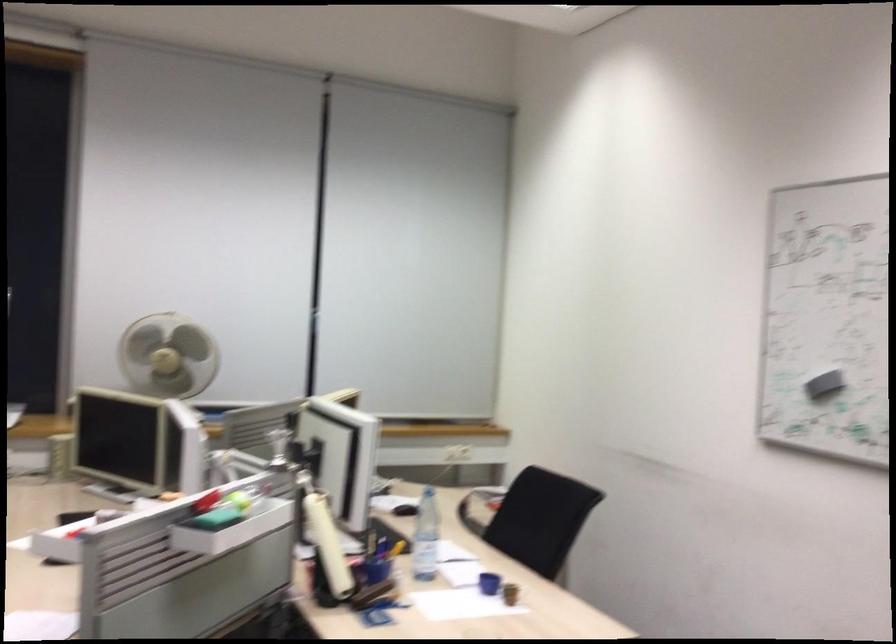
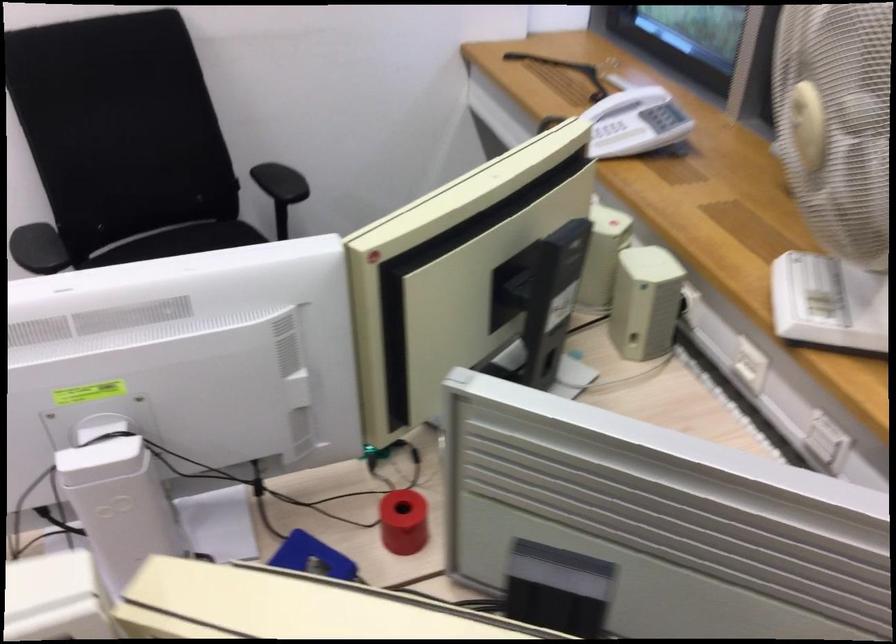
In the second image, find the point that corresponds to [143,360] in the first image.

(807, 125)